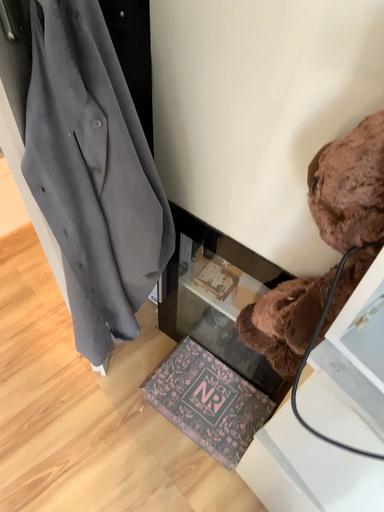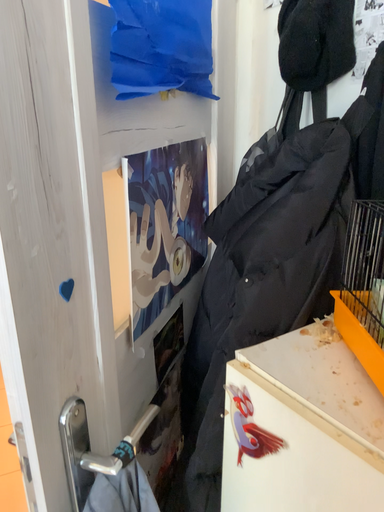
Question: Which way did the camera rotate in the video?

Choices:
 (A) rotated right
 (B) rotated left

Answer: (B)